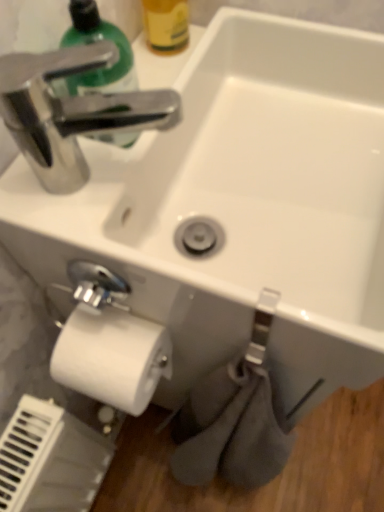
I want to click on free location in front of yellow matte bottle at upper center, so click(x=163, y=87).